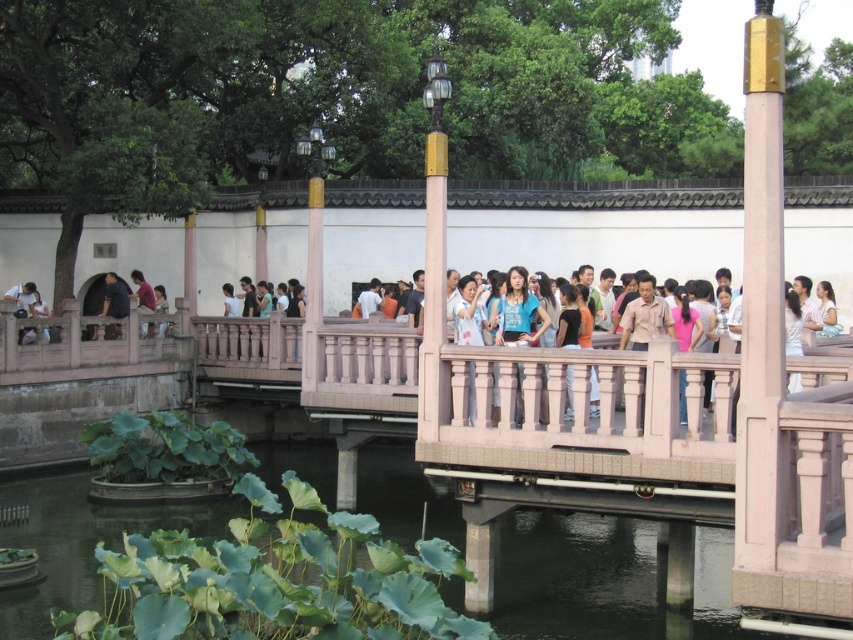
You are a photographer standing on the wooden bridge in the traditional Chinese garden. You notice a person wearing a matte pink shirt at center and light blue denim jeans at lower left. Which piece of clothing is higher in position?

The matte pink shirt at center is positioned over the light blue denim jeans at lower left, so the matte pink shirt at center is higher in position.

You are a photographer trying to capture a group photo of the people on the wooden bridge. You notice the dark gray shirt at left and the light blue denim jeans at lower left. Which clothing item should you focus on to ensure the entire group is in frame, considering their widths?

The dark gray shirt at left might be wider than light blue denim jeans at lower left, so focusing on the dark gray shirt at left would ensure the entire group is captured in the frame.

You are a tour guide leading a group across the wooden bridge in the traditional Chinese garden. You notice a tourist wearing a dark gray shirt at left and another tourist wearing light blue denim jeans at lower left. Can you determine if there is enough space for a 6.5 feet wide tour cart to pass between them?

The distance between the dark gray shirt at left and light blue denim jeans at lower left is 7.04 feet, which is wider than the 6.5 feet width of the tour cart. Therefore, the tour cart can safely pass between them.